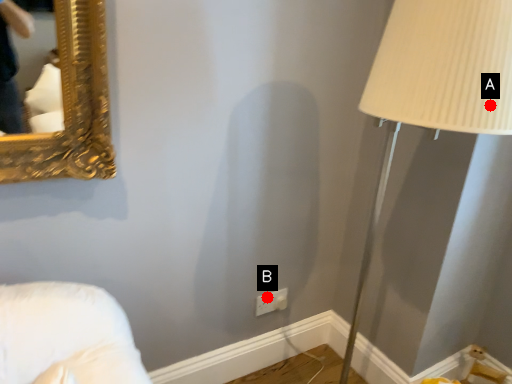
Question: Two points are circled on the image, labeled by A and B beside each circle. Among these points, which one is nearest to the camera?

Choices:
 (A) A is closer
 (B) B is closer

Answer: (A)